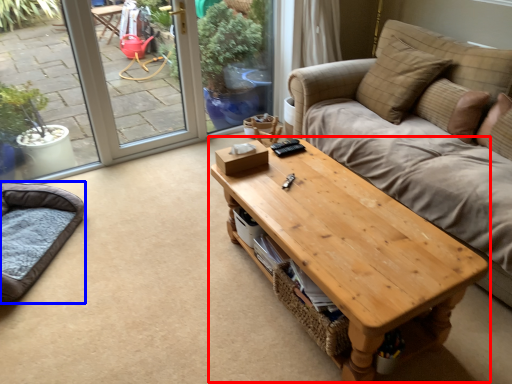
Question: Which object appears farthest to the camera in this image, coffee table (highlighted by a red box) or cat bed (highlighted by a blue box)?

Choices:
 (A) coffee table
 (B) cat bed

Answer: (B)